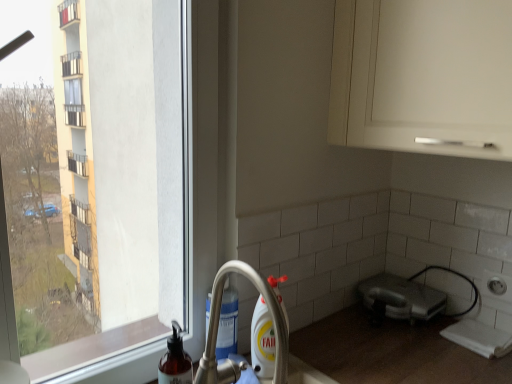
Question: Should I look upward or downward to see silver metallic faucet at lower center?

Choices:
 (A) down
 (B) up

Answer: (A)

Question: From a real-world perspective, is satin silver toaster at lower right positioned under silver metallic faucet at lower center based on gravity?

Choices:
 (A) no
 (B) yes

Answer: (B)

Question: Does satin silver toaster at lower right have a lesser width compared to silver metallic faucet at lower center?

Choices:
 (A) no
 (B) yes

Answer: (B)

Question: Is the depth of satin silver toaster at lower right greater than that of silver metallic faucet at lower center?

Choices:
 (A) yes
 (B) no

Answer: (A)

Question: Considering the relative sizes of satin silver toaster at lower right and silver metallic faucet at lower center in the image provided, is satin silver toaster at lower right smaller than silver metallic faucet at lower center?

Choices:
 (A) no
 (B) yes

Answer: (B)

Question: Does satin silver toaster at lower right have a greater height compared to silver metallic faucet at lower center?

Choices:
 (A) no
 (B) yes

Answer: (A)

Question: From a real-world perspective, is satin silver toaster at lower right positioned over silver metallic faucet at lower center based on gravity?

Choices:
 (A) no
 (B) yes

Answer: (A)

Question: Does silver metallic faucet at lower center lie behind translucent plastic soap dispenser at lower left?

Choices:
 (A) yes
 (B) no

Answer: (B)

Question: Can you confirm if silver metallic faucet at lower center is smaller than translucent plastic soap dispenser at lower left?

Choices:
 (A) yes
 (B) no

Answer: (B)

Question: Would you say translucent plastic soap dispenser at lower left is part of silver metallic faucet at lower center's contents?

Choices:
 (A) no
 (B) yes

Answer: (A)

Question: From the image's perspective, does silver metallic faucet at lower center appear lower than translucent plastic soap dispenser at lower left?

Choices:
 (A) yes
 (B) no

Answer: (B)

Question: Is silver metallic faucet at lower center far from translucent plastic soap dispenser at lower left?

Choices:
 (A) no
 (B) yes

Answer: (A)

Question: Does silver metallic faucet at lower center have a larger size compared to translucent plastic soap dispenser at lower left?

Choices:
 (A) no
 (B) yes

Answer: (B)

Question: Is translucent plastic soap dispenser at lower left not near silver metallic faucet at lower center?

Choices:
 (A) no
 (B) yes

Answer: (A)